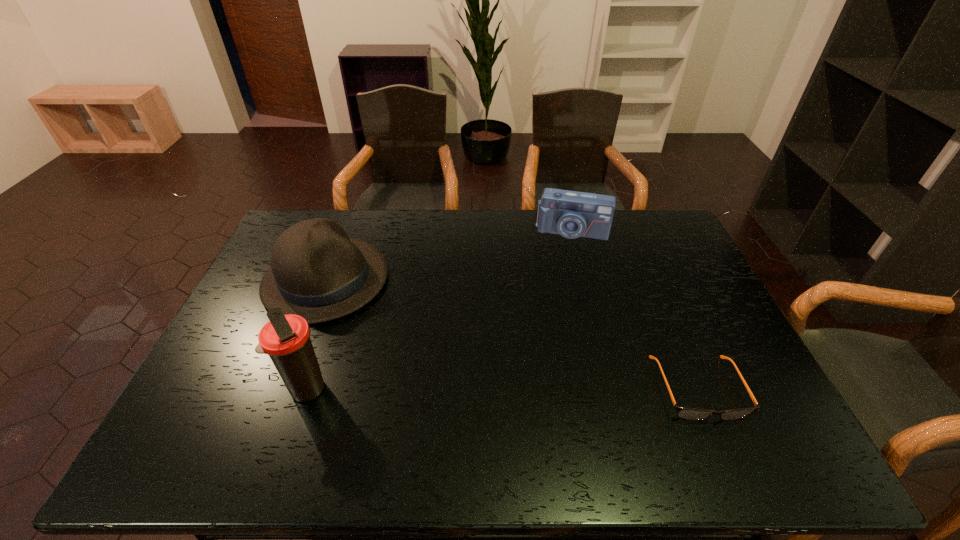
Where is `thermos bottle`? Image resolution: width=960 pixels, height=540 pixels. thermos bottle is located at coordinates (286, 339).

Where is `spectacles`? spectacles is located at coordinates (686, 413).

Identify the location of the farthest object. This screenshot has height=540, width=960. (572, 214).

Image resolution: width=960 pixels, height=540 pixels. What are the coordinates of `camera` in the screenshot? It's located at (572, 214).

You are a GUI agent. You are given a task and a screenshot of the screen. Output one action in this format:
    pyautogui.click(x=<x>, y=<y>)
    Task: Click on the second tallest object
    Image resolution: width=960 pixels, height=540 pixels.
    Given the screenshot: What is the action you would take?
    pyautogui.click(x=317, y=272)

Locate an element on the screen. This screenshot has width=960, height=540. bowler hat is located at coordinates (317, 272).

I want to click on free space located 0.280m on the right of the tallest object, so click(440, 389).

The height and width of the screenshot is (540, 960). I want to click on vacant space located 0.210m on the lens of the third tallest object, so click(559, 280).

The height and width of the screenshot is (540, 960). In order to click on vacant region located on the lens of the third tallest object in this screenshot , I will do `click(558, 288)`.

This screenshot has height=540, width=960. Find the location of `vacant position located 0.100m on the lens of the third tallest object`. vacant position located 0.100m on the lens of the third tallest object is located at coordinates (563, 259).